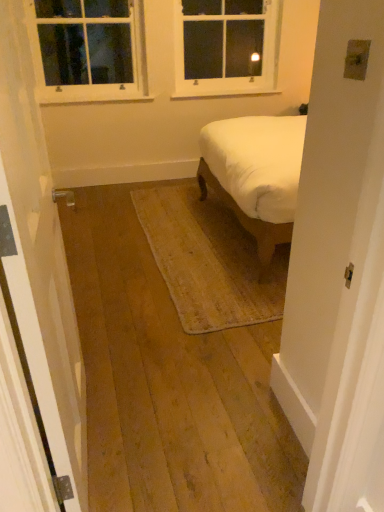
Question: Would you say white painted wood window at upper left, which appears as the first window when viewed from the left, is a long distance from white glass window at upper center, which is the second window from left to right?

Choices:
 (A) yes
 (B) no

Answer: (B)

Question: From a real-world perspective, is white painted wood window at upper left, which appears as the first window when viewed from the left, physically above white glass window at upper center, which is counted as the first window, starting from the right?

Choices:
 (A) yes
 (B) no

Answer: (A)

Question: Considering the relative sizes of white painted wood window at upper left, acting as the second window starting from the right, and white glass window at upper center, which is counted as the first window, starting from the right, in the image provided, is white painted wood window at upper left, acting as the second window starting from the right, bigger than white glass window at upper center, which is counted as the first window, starting from the right,?

Choices:
 (A) no
 (B) yes

Answer: (A)

Question: Does white painted wood window at upper left, acting as the second window starting from the right, appear on the right side of white glass window at upper center, which is the second window from left to right?

Choices:
 (A) yes
 (B) no

Answer: (B)

Question: Is white painted wood window at upper left, which appears as the first window when viewed from the left, to the left of white glass window at upper center, which is counted as the first window, starting from the right, from the viewer's perspective?

Choices:
 (A) no
 (B) yes

Answer: (B)

Question: Is white painted wood window at upper left, which appears as the first window when viewed from the left, wider or thinner than white glass window at upper center, which is the second window from left to right?

Choices:
 (A) wide
 (B) thin

Answer: (B)

Question: Is white painted wood window at upper left, acting as the second window starting from the right, in front of or behind white glass window at upper center, which is counted as the first window, starting from the right, in the image?

Choices:
 (A) front
 (B) behind

Answer: (A)

Question: Do you think white painted wood window at upper left, which appears as the first window when viewed from the left, is within white glass window at upper center, which is the second window from left to right, or outside of it?

Choices:
 (A) outside
 (B) inside

Answer: (A)

Question: Based on their sizes in the image, would you say white painted wood window at upper left, which appears as the first window when viewed from the left, is bigger or smaller than white glass window at upper center, which is the second window from left to right?

Choices:
 (A) small
 (B) big

Answer: (A)

Question: Visually, is white painted wood window at upper left, which appears as the first window when viewed from the left, positioned to the left or to the right of white wooden door at left?

Choices:
 (A) left
 (B) right

Answer: (A)

Question: Is white painted wood window at upper left, acting as the second window starting from the right, spatially inside white wooden door at left, or outside of it?

Choices:
 (A) outside
 (B) inside

Answer: (A)

Question: Relative to white wooden door at left, is white painted wood window at upper left, acting as the second window starting from the right, in front or behind?

Choices:
 (A) behind
 (B) front

Answer: (A)

Question: From their relative heights in the image, would you say white painted wood window at upper left, which appears as the first window when viewed from the left, is taller or shorter than white wooden door at left?

Choices:
 (A) tall
 (B) short

Answer: (B)

Question: Is white wooden door at left wider or thinner than white painted wood window at upper left, acting as the second window starting from the right?

Choices:
 (A) wide
 (B) thin

Answer: (B)

Question: Is point (34, 290) closer or farther from the camera than point (77, 12)?

Choices:
 (A) farther
 (B) closer

Answer: (B)